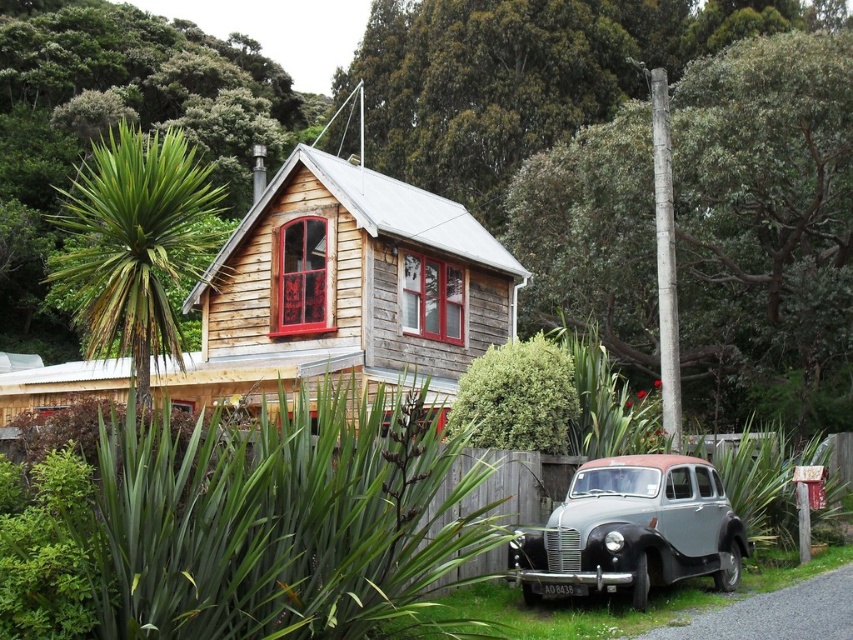
From the picture: Who is positioned more to the left, green leafy plant at center or gray metallic car at lower right?

green leafy plant at center is more to the left.

Locate an element on the screen. This screenshot has height=640, width=853. green leafy plant at center is located at coordinates coord(277,518).